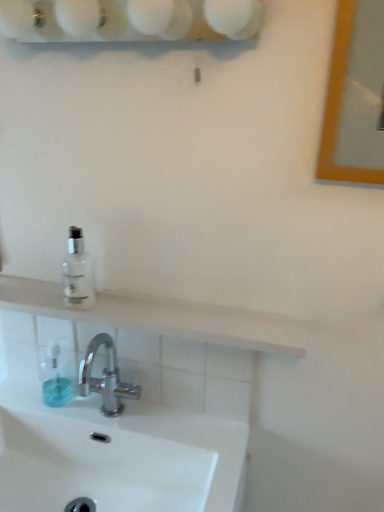
Where is `free location to the left of transparent plastic soap dispenser at lower left`? free location to the left of transparent plastic soap dispenser at lower left is located at coordinates (24, 395).